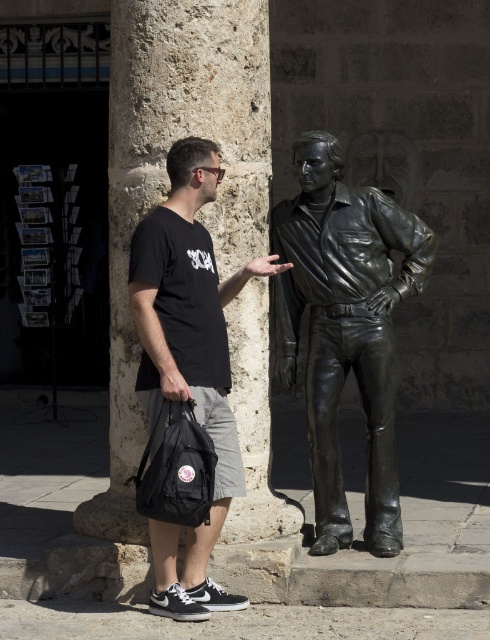
Based on the coordinates provided, where is the bronze statue at center located in the image?

The bronze statue at center is located at the point with coordinates 0.514 on the x axis and 0.706 on the y axis.